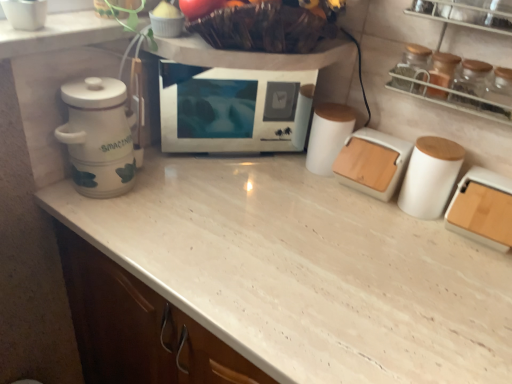
Question: In the image, is transparent glass jar at upper right on the left side or the right side of white ceramic canister at left?

Choices:
 (A) right
 (B) left

Answer: (A)

Question: Relative to white ceramic canister at left, is transparent glass jar at upper right in front or behind?

Choices:
 (A) behind
 (B) front

Answer: (A)

Question: Considering the real-world distances, which object is closest to the wooden lid container at right, which is the third kitchen appliance from left to right?

Choices:
 (A) white matte bread bin at center-right, marked as the third kitchen appliance in a right-to-left arrangement
 (B) transparent glass jar at upper right
 (C) transparent glass jar at upper right
 (D) white ceramic canister at left
 (E) transparent glass jars at upper right

Answer: (A)

Question: Which is farther from the transparent glass jars at upper right?

Choices:
 (A) wooden lid container at right, which is the third kitchen appliance from left to right
 (B) white matte microwave oven at center
 (C) white matte container at right, the second kitchen appliance positioned from the left
 (D) white matte container at center
 (E) white matte bread bin at center-right, marked as the third kitchen appliance in a right-to-left arrangement

Answer: (B)